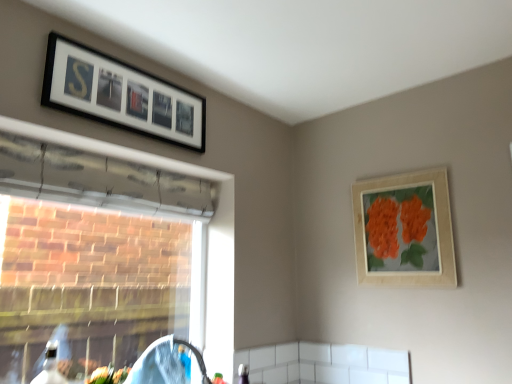
Question: Is transparent plastic window at left positioned in front of black matte picture frame at upper left, the 2th picture frame positioned from the bottom?

Choices:
 (A) no
 (B) yes

Answer: (B)

Question: Is transparent plastic window at left facing towards black matte picture frame at upper left, the 2th picture frame positioned from the bottom?

Choices:
 (A) no
 (B) yes

Answer: (A)

Question: Is transparent plastic window at left at the right side of black matte picture frame at upper left, the 2th picture frame positioned from the bottom?

Choices:
 (A) yes
 (B) no

Answer: (B)

Question: Is there a large distance between transparent plastic window at left and black matte picture frame at upper left, the 1th picture frame positioned from the left?

Choices:
 (A) yes
 (B) no

Answer: (B)

Question: Would you say black matte picture frame at upper left, the 1th picture frame positioned from the left, is part of transparent plastic window at left's contents?

Choices:
 (A) no
 (B) yes

Answer: (A)

Question: Considering the relative sizes of transparent plastic window at left and black matte picture frame at upper left, the second picture frame in the right-to-left sequence, in the image provided, is transparent plastic window at left wider than black matte picture frame at upper left, the second picture frame in the right-to-left sequence,?

Choices:
 (A) yes
 (B) no

Answer: (A)

Question: Does black matte picture frame at upper left, the second picture frame in the right-to-left sequence, have a greater height compared to wooden picture frame at upper right, which is the 1th picture frame in bottom-to-top order?

Choices:
 (A) no
 (B) yes

Answer: (A)

Question: From a real-world perspective, is black matte picture frame at upper left, the 1th picture frame positioned from the left, positioned under wooden picture frame at upper right, which is the 1th picture frame in bottom-to-top order, based on gravity?

Choices:
 (A) no
 (B) yes

Answer: (A)

Question: Does black matte picture frame at upper left, the 2th picture frame positioned from the bottom, have a lesser width compared to wooden picture frame at upper right, the 2th picture frame positioned from the left?

Choices:
 (A) no
 (B) yes

Answer: (A)

Question: Is wooden picture frame at upper right, which appears as the first picture frame when viewed from the right, located within black matte picture frame at upper left, the second picture frame in the right-to-left sequence?

Choices:
 (A) yes
 (B) no

Answer: (B)

Question: Could you tell me if black matte picture frame at upper left, the second picture frame in the right-to-left sequence, is facing wooden picture frame at upper right, which appears as the first picture frame when viewed from the right?

Choices:
 (A) no
 (B) yes

Answer: (A)

Question: Are black matte picture frame at upper left, the 1th picture frame positioned from the left, and wooden picture frame at upper right, which is the 1th picture frame in bottom-to-top order, far apart?

Choices:
 (A) yes
 (B) no

Answer: (A)

Question: Is transparent plastic window at left at the back of wooden picture frame at upper right, the 2th picture frame positioned from the left?

Choices:
 (A) no
 (B) yes

Answer: (A)